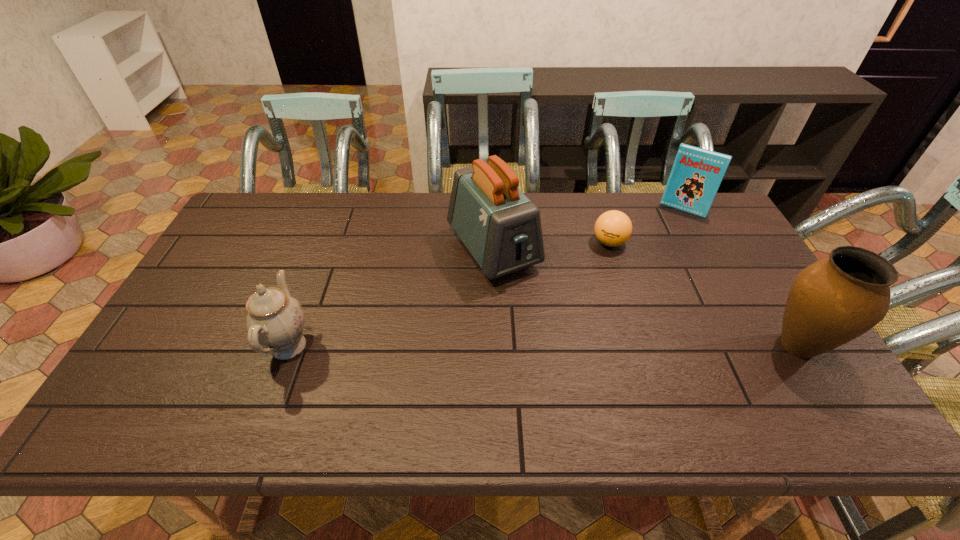
I want to click on empty space between the urn and the leftmost object, so click(543, 346).

At what (x,y) coordinates should I click in order to perform the action: click on vacant area that lies between the urn and the second object from left to right. Please return your answer as a coordinate pair (x, y). This screenshot has height=540, width=960. Looking at the image, I should click on (646, 298).

Locate an element on the screen. vacant area between the leftmost object and the toaster is located at coordinates (391, 298).

Where is `vacant point located between the urn and the leftmost object`? Image resolution: width=960 pixels, height=540 pixels. vacant point located between the urn and the leftmost object is located at coordinates (543, 346).

Find the location of a particular element. free space between the second object from left to right and the book is located at coordinates (588, 230).

Locate which object ranks fourth in proximity to the urn. Please provide its 2D coordinates. Your answer should be formatted as a tuple, i.e. [(x, y)], where the tuple contains the x and y coordinates of a point satisfying the conditions above.

[(274, 319)]

Identify which object is the third closest to the third object from right to left. Please provide its 2D coordinates. Your answer should be formatted as a tuple, i.e. [(x, y)], where the tuple contains the x and y coordinates of a point satisfying the conditions above.

[(831, 302)]

The image size is (960, 540). I want to click on free point that satisfies the following two spatial constraints: 1. on the front side of the book; 2. on the right side of the urn, so click(x=756, y=345).